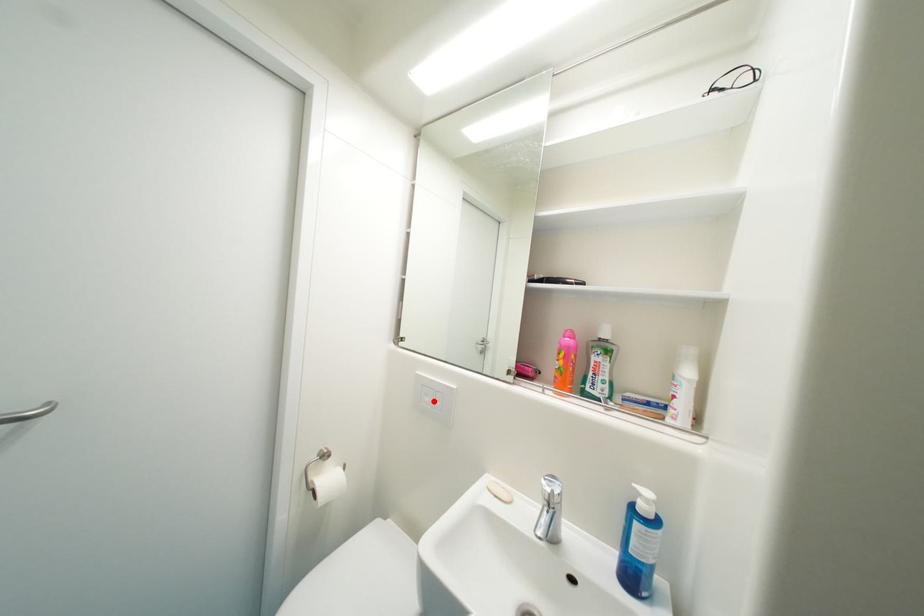
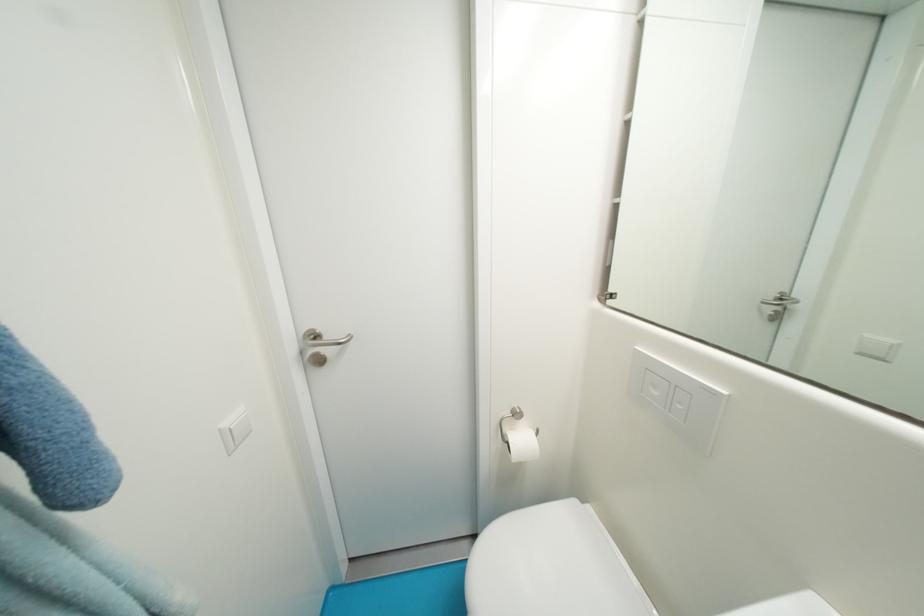
Locate, in the second image, the point that corresponds to the highlighted location in the first image.

(662, 395)